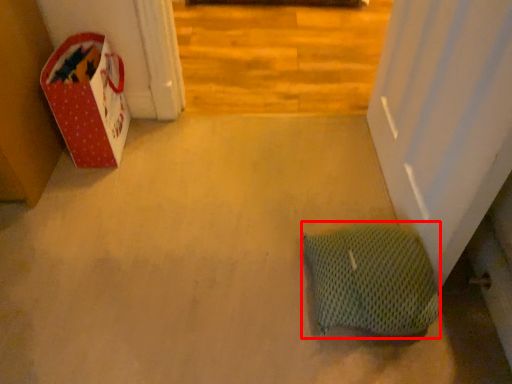
Question: Observing the image, what is the correct spatial positioning of pillow (annotated by the red box) in reference to cardboard box?

Choices:
 (A) right
 (B) left

Answer: (A)